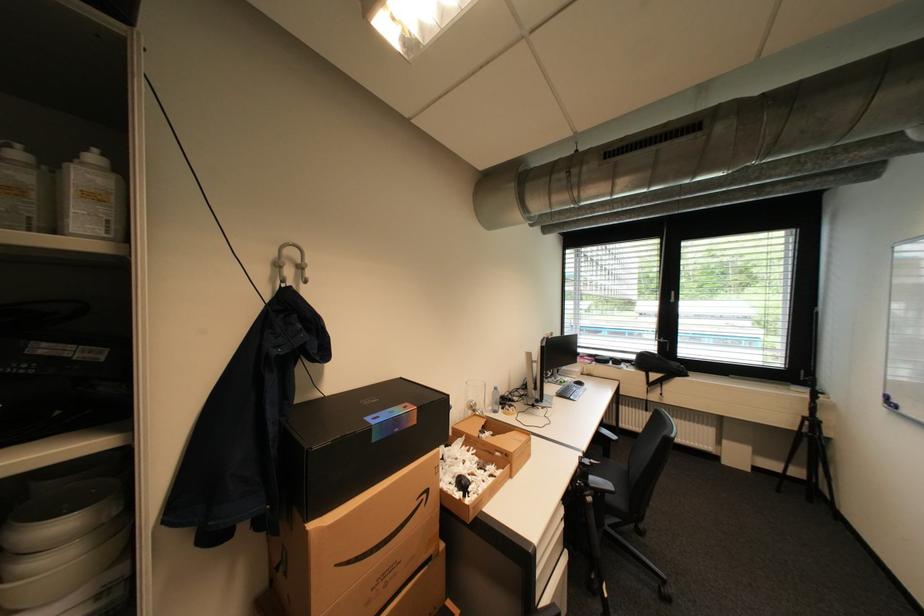
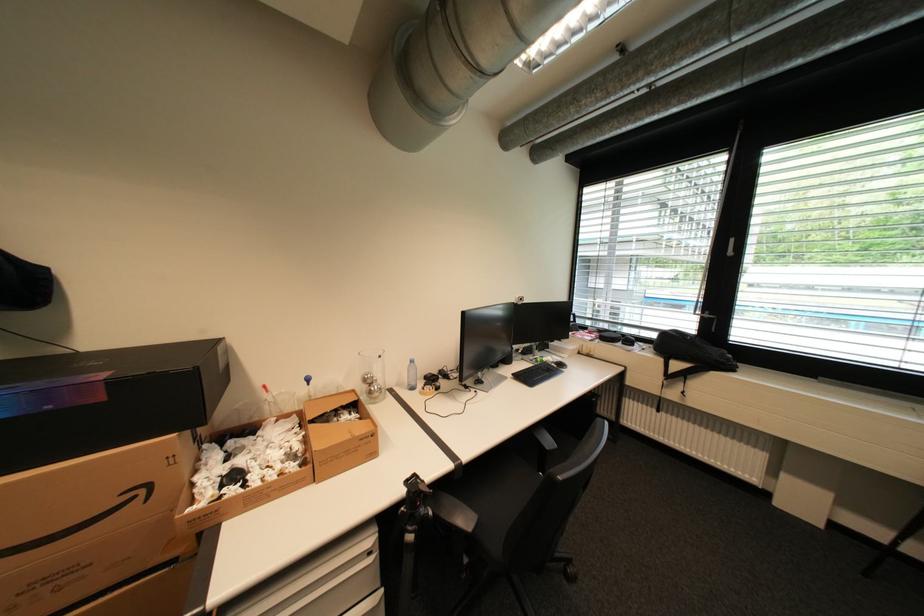
In the second image, find the point that corresponds to point 535,444 in the first image.

(370, 440)